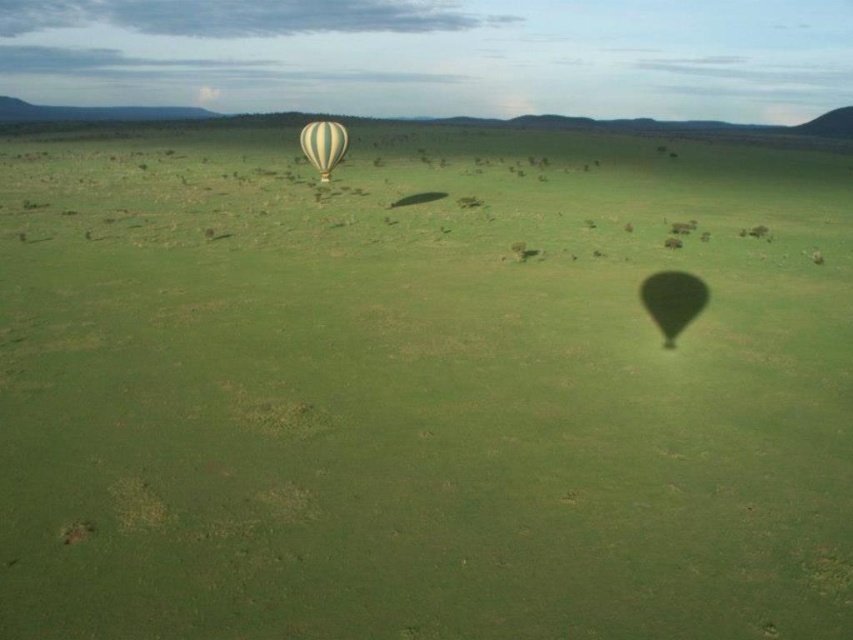
You are a photographer standing on the grassland and want to capture both the translucent yellow balloon at lower right and the yellow striped fabric balloon at center in your photo. Which balloon should you focus on first to ensure both are in the frame?

You should focus on the translucent yellow balloon at lower right first because it is closer to you than the yellow striped fabric balloon at center, so adjusting the camera to include it will naturally include the farther balloon as well.

You are a photographer trying to capture both the translucent yellow balloon at lower right and the yellow striped fabric balloon at center in a single shot. Based on their sizes in the image, which balloon would appear smaller in the photo?

The translucent yellow balloon at lower right occupies less space than the yellow striped fabric balloon at center, so it would appear smaller in the photo.

You are a bird soaring above the grassland and want to land on the closest balloon to the ground. Which one should you choose between the translucent yellow balloon at lower right and the yellow striped fabric balloon at center?

The translucent yellow balloon at lower right is located below the yellow striped fabric balloon at center, so it is closer to the ground. You should choose the translucent yellow balloon at lower right to land on.